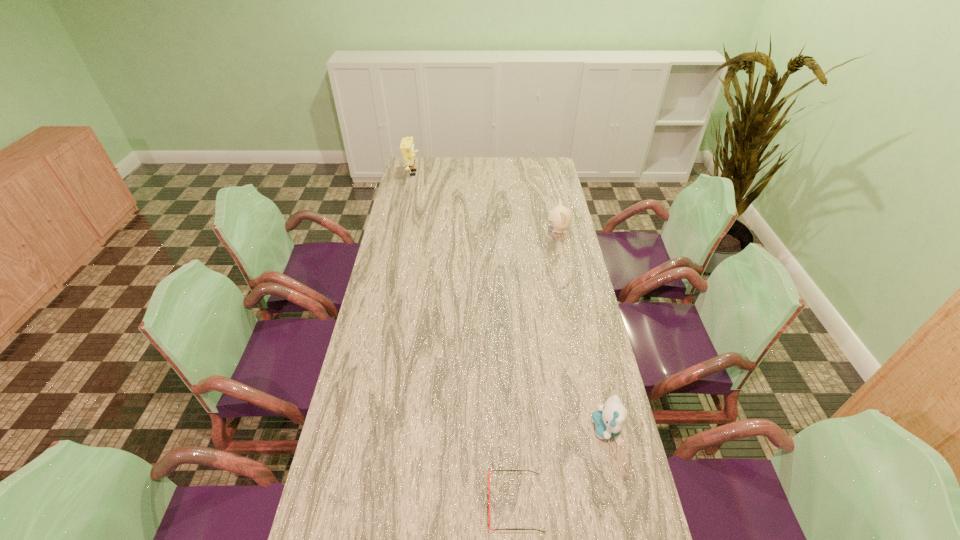
You are a GUI agent. You are given a task and a screenshot of the screen. Output one action in this format:
    pyautogui.click(x=<x>, y=<y>)
    Task: Click on the sponge
    
    Given the screenshot: What is the action you would take?
    pyautogui.click(x=407, y=148)

At what (x,y) coordinates should I click in order to perform the action: click on the farthest object. Please return your answer as a coordinate pair (x, y). The width and height of the screenshot is (960, 540). Looking at the image, I should click on (407, 148).

Locate an element on the screen. This screenshot has width=960, height=540. the farther kitten is located at coordinates (559, 218).

Identify the location of the third farthest object. The image size is (960, 540). (610, 419).

Locate an element on the screen. spectacles is located at coordinates (488, 470).

Locate an element on the screen. Image resolution: width=960 pixels, height=540 pixels. the second object from left to right is located at coordinates (488, 470).

Identify the location of free space located 0.270m on the face of the sponge. This screenshot has height=540, width=960. (472, 173).

Locate an element on the screen. This screenshot has width=960, height=540. free space located on the face of the farther kitten is located at coordinates (459, 231).

Locate an element on the screen. free space located 0.160m on the face of the farther kitten is located at coordinates (510, 231).

At what (x,y) coordinates should I click in order to perform the action: click on free location located on the face of the farther kitten. Please return your answer as a coordinate pair (x, y). This screenshot has width=960, height=540. Looking at the image, I should click on (475, 231).